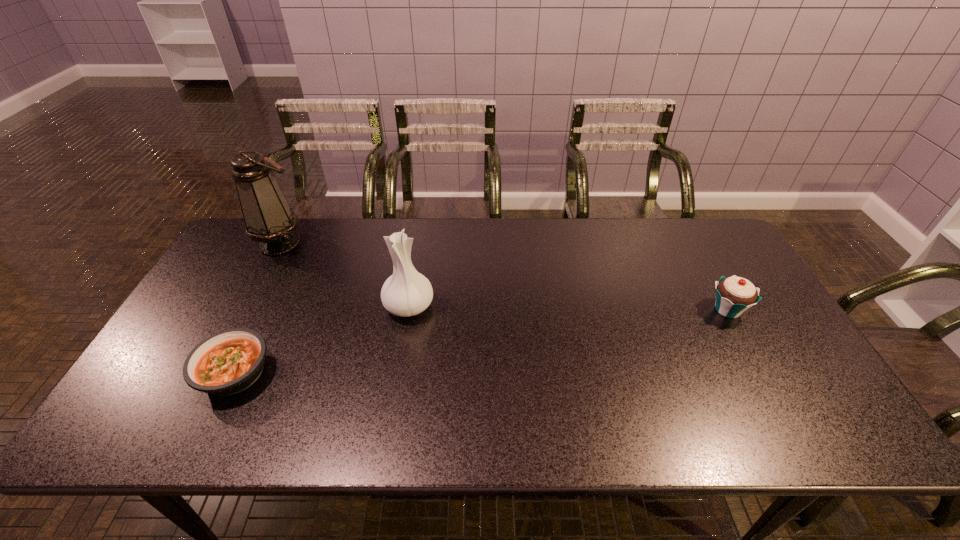
Locate an element on the screen. The image size is (960, 540). oil lamp is located at coordinates (269, 220).

The image size is (960, 540). Identify the location of the tallest object. (269, 220).

In order to click on the second object from right to left in this screenshot , I will do `click(406, 292)`.

Where is `the third shortest object`? The width and height of the screenshot is (960, 540). the third shortest object is located at coordinates (406, 292).

Where is `the rightmost object`? Image resolution: width=960 pixels, height=540 pixels. the rightmost object is located at coordinates (734, 295).

This screenshot has width=960, height=540. I want to click on the third tallest object, so click(x=734, y=295).

You are a GUI agent. You are given a task and a screenshot of the screen. Output one action in this format:
    pyautogui.click(x=<x>, y=<y>)
    Task: Click on the stew
    Image resolution: width=960 pixels, height=540 pixels.
    Given the screenshot: What is the action you would take?
    pyautogui.click(x=228, y=362)

Locate an element on the screen. The width and height of the screenshot is (960, 540). the shortest object is located at coordinates (228, 362).

What are the coordinates of `blank space located on the right of the tallest object` in the screenshot? It's located at (396, 242).

You are a GUI agent. You are given a task and a screenshot of the screen. Output one action in this format:
    pyautogui.click(x=<x>, y=<y>)
    Task: Click on the free region located 0.320m on the left of the second tallest object
    Image resolution: width=960 pixels, height=540 pixels.
    Given the screenshot: What is the action you would take?
    pyautogui.click(x=272, y=306)